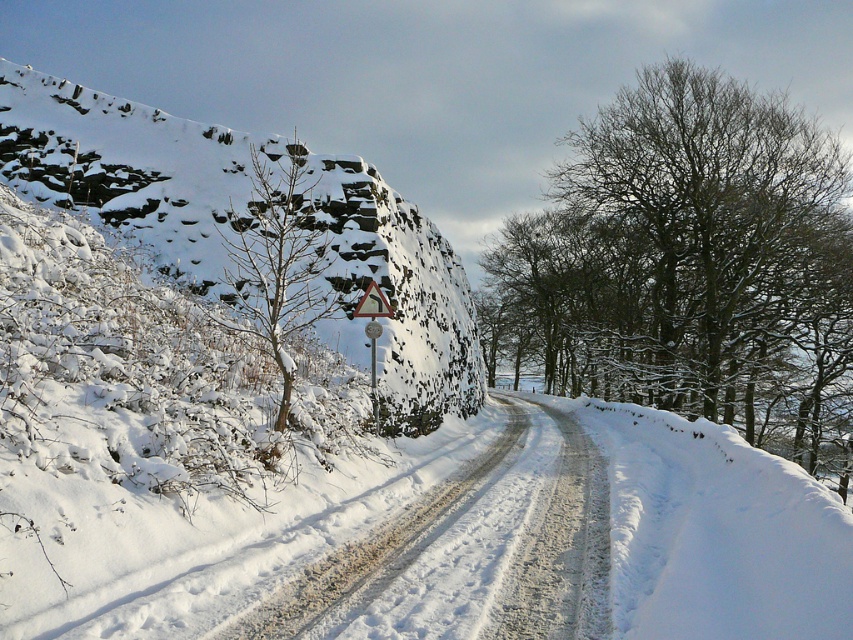
Can you confirm if rocky snow-covered hillside at upper left is wider than snow-covered tree at center-left?

Yes.

Between rocky snow-covered hillside at upper left and snow-covered tree at center-left, which one has more height?

rocky snow-covered hillside at upper left is taller.

Does point (355, 328) come closer to viewer compared to point (271, 228)?

Yes, it is in front of point (271, 228).

Where is `rocky snow-covered hillside at upper left`? rocky snow-covered hillside at upper left is located at coordinates (248, 216).

Who is more distant from viewer, (x=570, y=339) or (x=223, y=632)?

The point (x=570, y=339) is behind.

Does bare branches at center appear on the left side of white snow-covered road at center?

In fact, bare branches at center is to the right of white snow-covered road at center.

Does point (631, 214) lie behind point (469, 609)?

Yes, it is behind point (469, 609).

Where is `bare branches at center`? bare branches at center is located at coordinates (691, 266).

How much distance is there between white snow-covered road at center and snow-covered tree at center-left?

5.40 meters

Between white snow-covered road at center and snow-covered tree at center-left, which one has less height?

white snow-covered road at center

Is point (492, 586) positioned after point (283, 275)?

No, (492, 586) is closer to viewer.

The height and width of the screenshot is (640, 853). What are the coordinates of `white snow-covered road at center` in the screenshot? It's located at (469, 550).